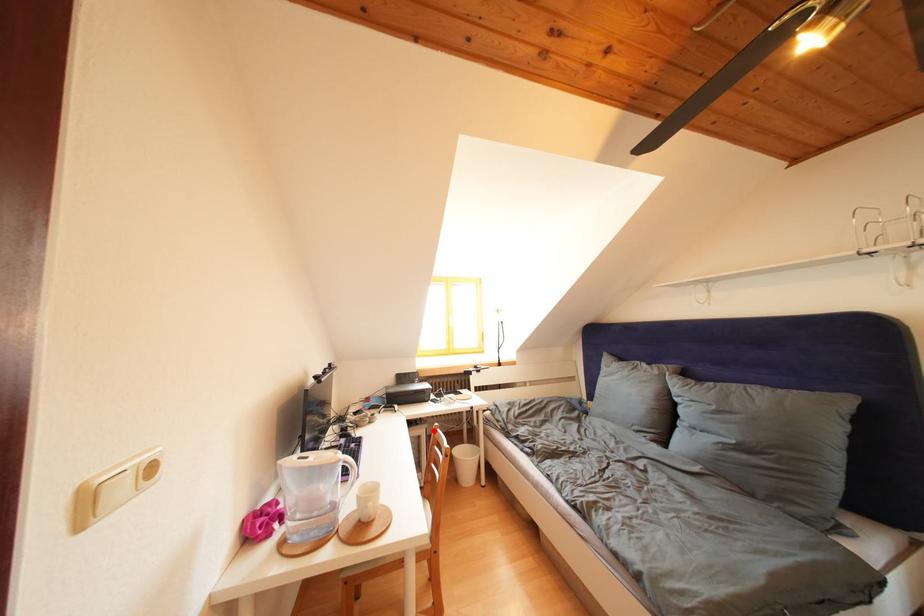
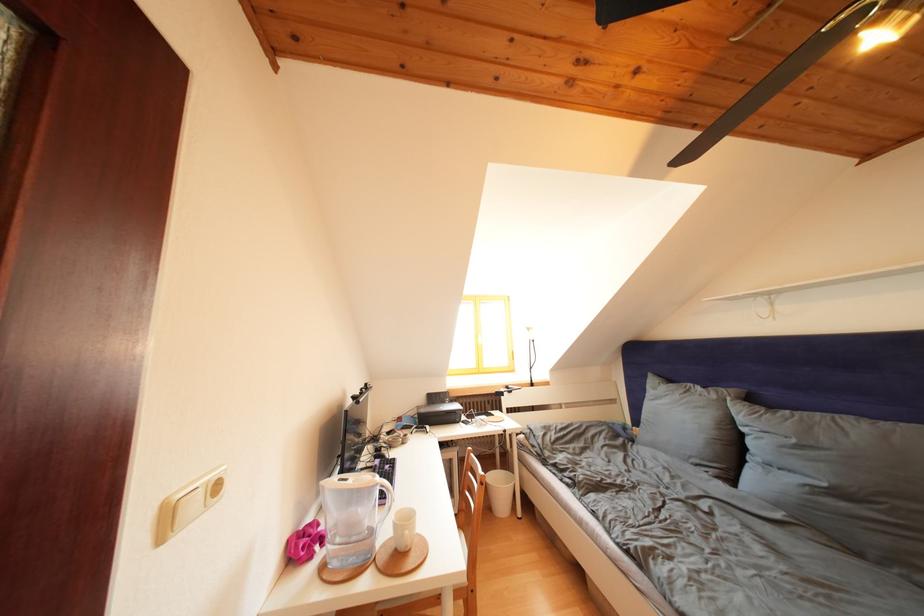
Locate, in the second image, the point that corresponds to the highlighted location in the first image.

(466, 454)